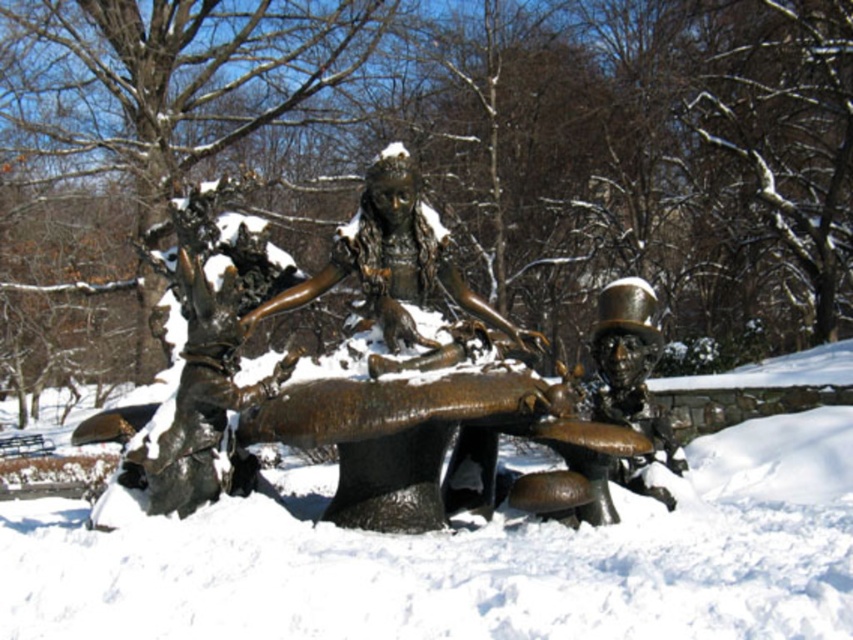
Question: Which object is closer to the camera taking this photo?

Choices:
 (A) slightly frosted bronze table at center
 (B) bronze statue at center

Answer: (A)

Question: From the image, what is the correct spatial relationship of slightly frosted bronze table at center in relation to bronze statue at center?

Choices:
 (A) above
 (B) below

Answer: (B)

Question: Can you confirm if slightly frosted bronze table at center is positioned to the right of bronze statue at center?

Choices:
 (A) no
 (B) yes

Answer: (B)

Question: From the image, what is the correct spatial relationship of slightly frosted bronze table at center in relation to bronze statue at center?

Choices:
 (A) left
 (B) right

Answer: (B)

Question: Which point is farther to the camera?

Choices:
 (A) bronze statue at center
 (B) slightly frosted bronze table at center

Answer: (A)